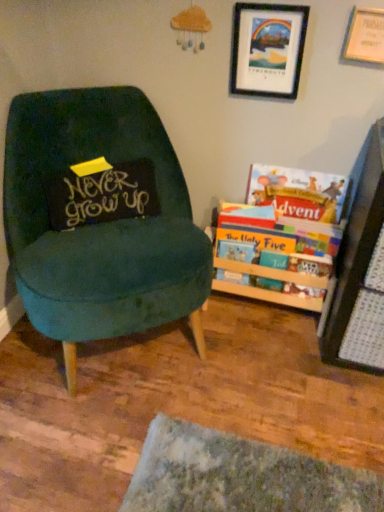
Question: Does black fabric pillow at left have a greater width compared to teal velvet chair at left?

Choices:
 (A) yes
 (B) no

Answer: (B)

Question: Considering the relative sizes of black fabric pillow at left and teal velvet chair at left in the image provided, is black fabric pillow at left shorter than teal velvet chair at left?

Choices:
 (A) no
 (B) yes

Answer: (B)

Question: Is black fabric pillow at left to the left of teal velvet chair at left from the viewer's perspective?

Choices:
 (A) yes
 (B) no

Answer: (A)

Question: Is black fabric pillow at left taller than teal velvet chair at left?

Choices:
 (A) no
 (B) yes

Answer: (A)

Question: Does black fabric pillow at left come in front of teal velvet chair at left?

Choices:
 (A) yes
 (B) no

Answer: (B)

Question: Considering the positions of hardcover book at right, acting as the 1th book starting from the top, and black fabric pillow at left in the image, is hardcover book at right, acting as the 1th book starting from the top, taller or shorter than black fabric pillow at left?

Choices:
 (A) tall
 (B) short

Answer: (A)

Question: Based on their positions, is hardcover book at right, which ranks as the 3th book in bottom-to-top order, located to the left or right of black fabric pillow at left?

Choices:
 (A) right
 (B) left

Answer: (A)

Question: Based on their sizes in the image, would you say hardcover book at right, which ranks as the 3th book in bottom-to-top order, is bigger or smaller than black fabric pillow at left?

Choices:
 (A) big
 (B) small

Answer: (B)

Question: From a real-world perspective, is hardcover book at right, acting as the 1th book starting from the top, above or below black fabric pillow at left?

Choices:
 (A) below
 (B) above

Answer: (A)

Question: Looking at their shapes, would you say teal velvet chair at left is wider or thinner than hardcover book at right, acting as the 1th book starting from the top?

Choices:
 (A) wide
 (B) thin

Answer: (A)

Question: Based on their positions, is teal velvet chair at left located to the left or right of hardcover book at right, acting as the 1th book starting from the top?

Choices:
 (A) right
 (B) left

Answer: (B)

Question: Is teal velvet chair at left taller or shorter than hardcover book at right, acting as the 1th book starting from the top?

Choices:
 (A) tall
 (B) short

Answer: (A)

Question: Which is correct: teal velvet chair at left is inside hardcover book at right, which ranks as the 3th book in bottom-to-top order, or outside of it?

Choices:
 (A) outside
 (B) inside

Answer: (A)

Question: Would you say black matte picture frame at upper right, placed as the 1th picture frame when sorted from left to right, is to the left or to the right of teal velvet chair at left in the picture?

Choices:
 (A) right
 (B) left

Answer: (A)

Question: Would you say black matte picture frame at upper right, placed as the 1th picture frame when sorted from left to right, is inside or outside teal velvet chair at left?

Choices:
 (A) inside
 (B) outside

Answer: (B)